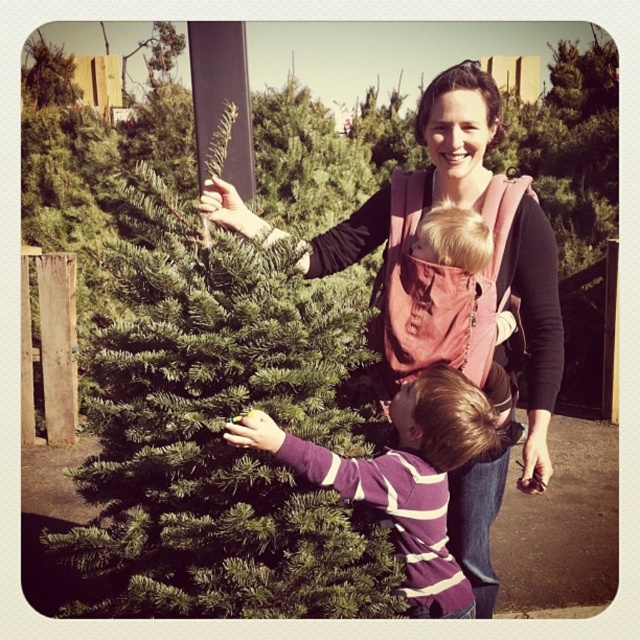
Which is in front, point (500, 365) or point (316, 465)?

Point (316, 465)

Who is shorter, pink fabric carrier at center or purple striped sweater at center?

With less height is purple striped sweater at center.

Between point (548, 387) and point (394, 486), which one is positioned in front?

Point (394, 486) is in front.

Identify the location of pink fabric carrier at center. (492, 253).

Who is positioned more to the right, green matte christmas tree at left or pink fabric carrier at center?

Answer: pink fabric carrier at center is more to the right.

Does green matte christmas tree at left appear under pink fabric carrier at center?

Incorrect, green matte christmas tree at left is not positioned below pink fabric carrier at center.

Describe the element at coordinates (218, 432) in the screenshot. I see `green matte christmas tree at left` at that location.

What are the coordinates of `green matte christmas tree at left` in the screenshot? It's located at (218, 432).

In the scene shown: Is green matte christmas tree at left taller than purple striped sweater at center?

Yes, green matte christmas tree at left is taller than purple striped sweater at center.

Is point (100, 520) less distant than point (419, 609)?

That is False.

I want to click on green matte christmas tree at left, so click(x=218, y=432).